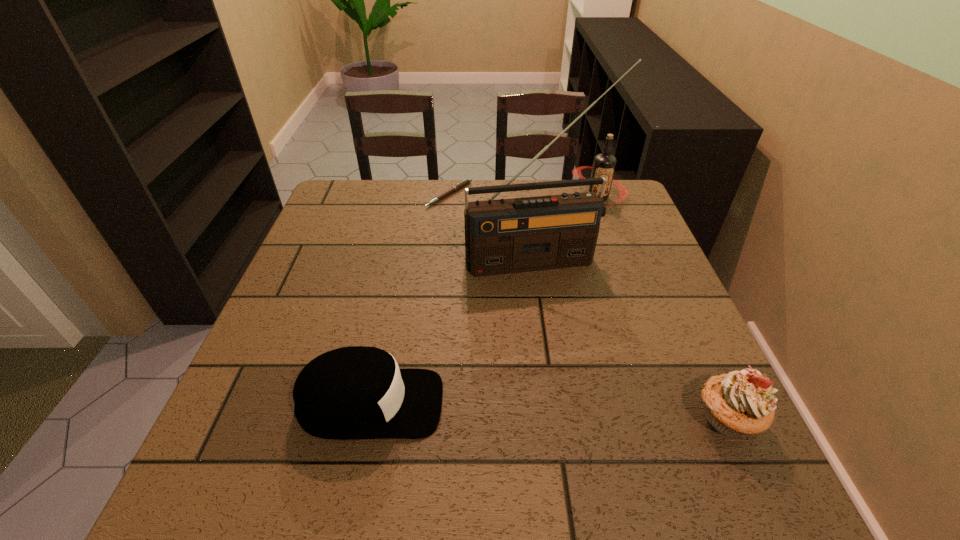
Find the location of a particular element. Image resolution: width=960 pixels, height=540 pixels. object that is the third closest to the cap is located at coordinates (458, 186).

In order to click on the closest object to the shortest object in this screenshot , I will do `click(505, 236)`.

The image size is (960, 540). I want to click on vacant area that satisfies the following two spatial constraints: 1. on the front side of the cupcake; 2. on the left side of the root beer, so click(679, 417).

The width and height of the screenshot is (960, 540). Identify the location of vacant space that satisfies the following two spatial constraints: 1. on the front side of the cupcake; 2. on the right side of the fourth shortest object. (679, 417).